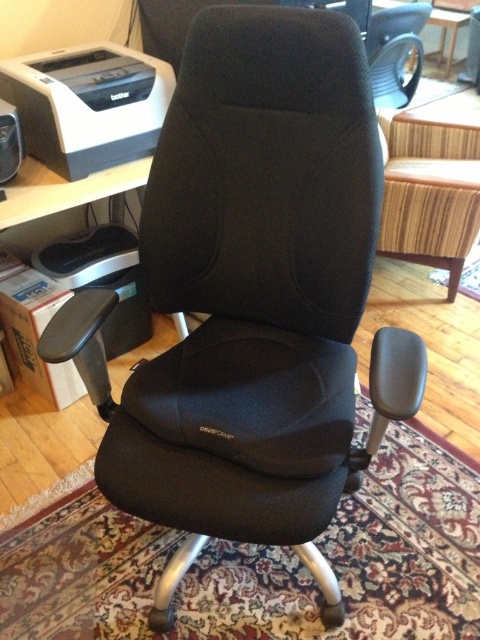
Does matte black printer at upper left lie in front of black matte speaker at upper left?

No, it is behind black matte speaker at upper left.

Is point (130, 104) positioned behind point (4, 160)?

Yes.

Locate an element on the screen. The width and height of the screenshot is (480, 640). matte black printer at upper left is located at coordinates (87, 106).